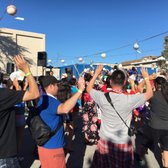
This screenshot has height=168, width=168. I want to click on blue wall, so click(x=78, y=68), click(x=108, y=67), click(x=149, y=71).